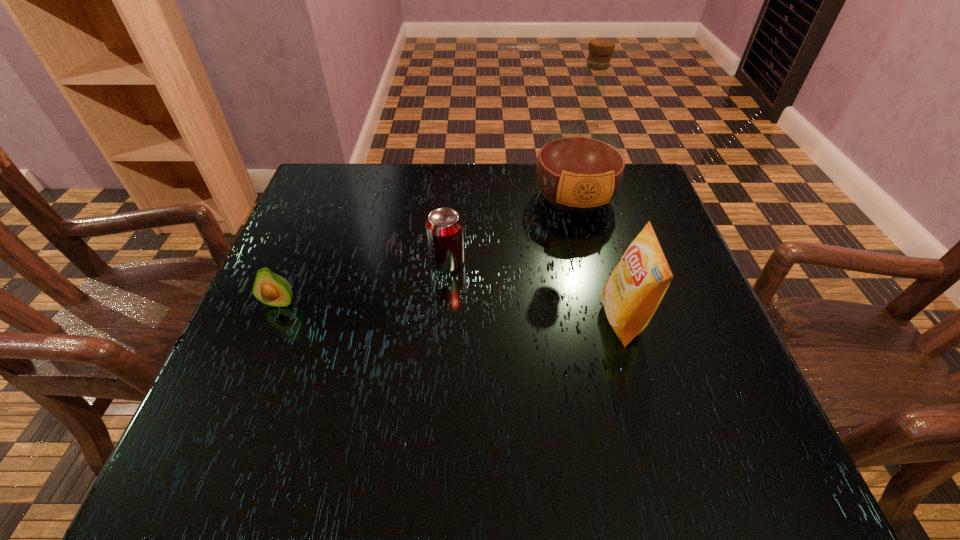
Identify the location of free space at the far left corner. (362, 178).

In the image, there is a desktop. Identify the location of vacant space at the near left corner. (240, 443).

The image size is (960, 540). Identify the location of vacant space at the far right corner of the desktop. (621, 202).

Image resolution: width=960 pixels, height=540 pixels. In the image, there is a desktop. Find the location of `vacant region at the near right corner`. vacant region at the near right corner is located at coordinates (731, 432).

You are a GUI agent. You are given a task and a screenshot of the screen. Output one action in this format:
    pyautogui.click(x=<x>, y=<y>)
    Task: Click on the empty space between the avocado and the third shortest object
    The width and height of the screenshot is (960, 540).
    Given the screenshot: What is the action you would take?
    pyautogui.click(x=451, y=310)

Identify the location of free spot between the second farthest object and the second tallest object. (535, 291).

At what (x,y) coordinates should I click in order to perform the action: click on vacant space in between the liquor and the second farthest object. Please return your answer as a coordinate pair (x, y). The height and width of the screenshot is (540, 960). Looking at the image, I should click on (511, 230).

Identify the location of free space between the farthest object and the third tallest object. (511, 230).

Find the location of a particular element. Image resolution: width=960 pixels, height=540 pixels. vacant area between the leftmost object and the tallest object is located at coordinates (427, 250).

Find the location of a particular element. unoccupied position between the third nearest object and the third shortest object is located at coordinates click(535, 291).